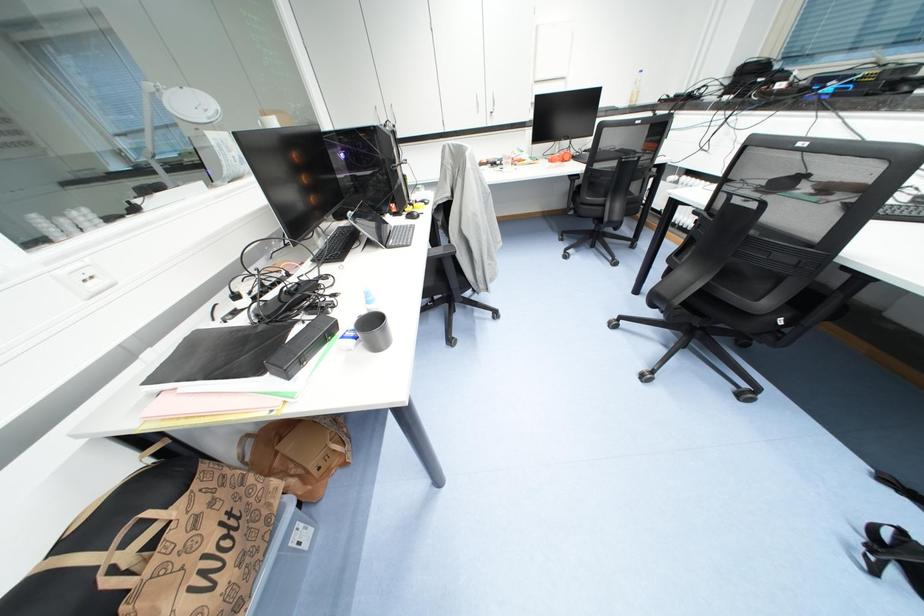
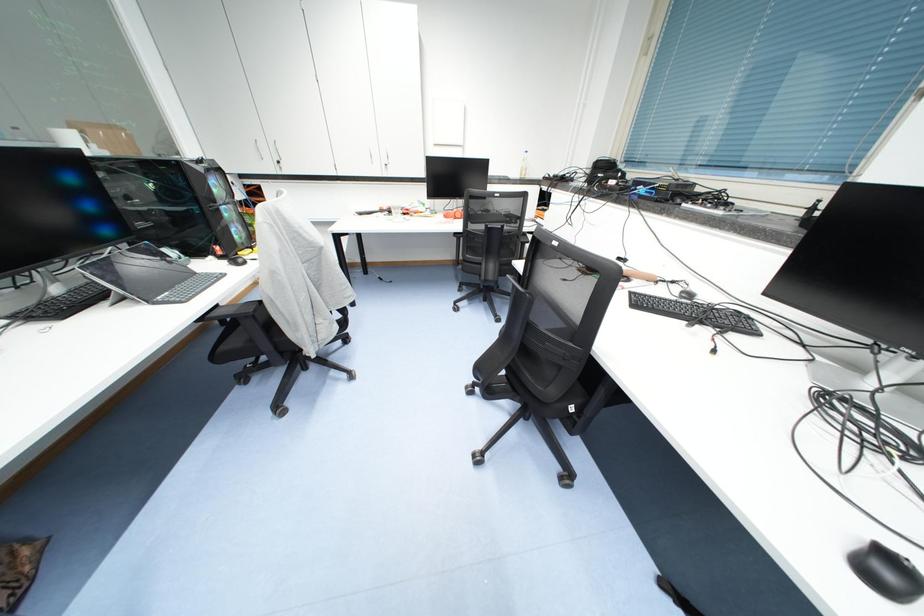
Question: The camera is either moving clockwise (left) or counter-clockwise (right) around the object. The first image is from the beginning of the video and the second image is from the end. Is the camera moving left or right when shooting the video?

Choices:
 (A) Left
 (B) Right

Answer: (A)